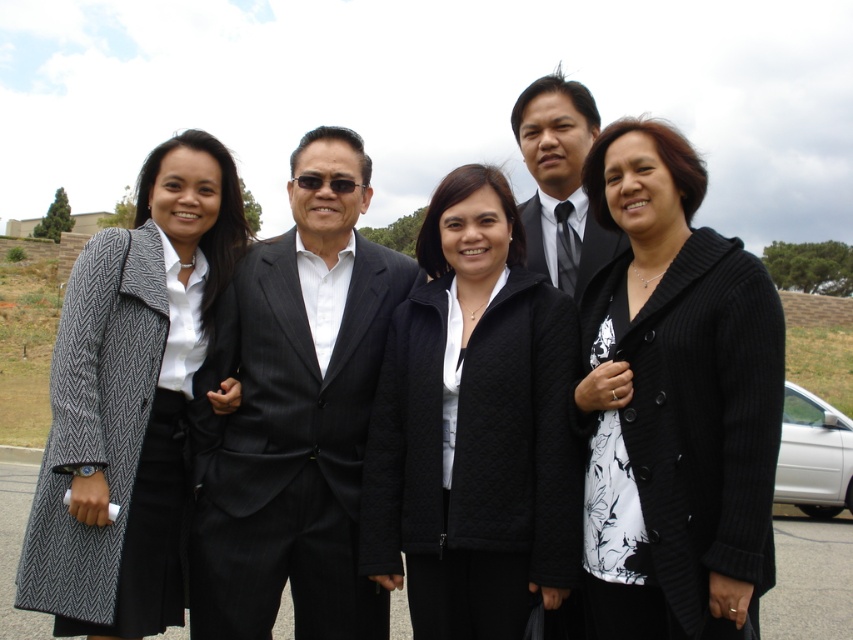
You are a photographer trying to capture a clear shot of the matte black suit at center and the black pinstripe suit at center. Which suit is blocking the view of the other?

The matte black suit at center is positioned over the black pinstripe suit at center, so it is blocking the view of the black pinstripe suit at center.